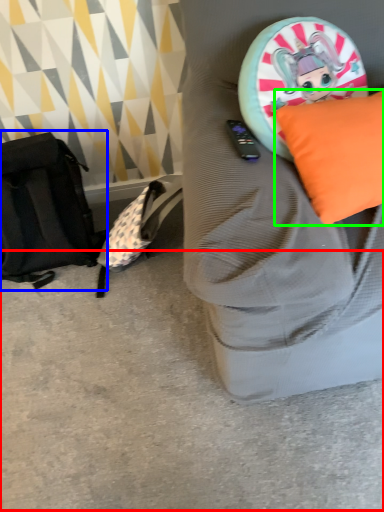
Question: Based on their relative distances, which object is farther from concrete (highlighted by a red box)? Choose from messenger bag (highlighted by a blue box) and pillow (highlighted by a green box).

Choices:
 (A) messenger bag
 (B) pillow

Answer: (B)